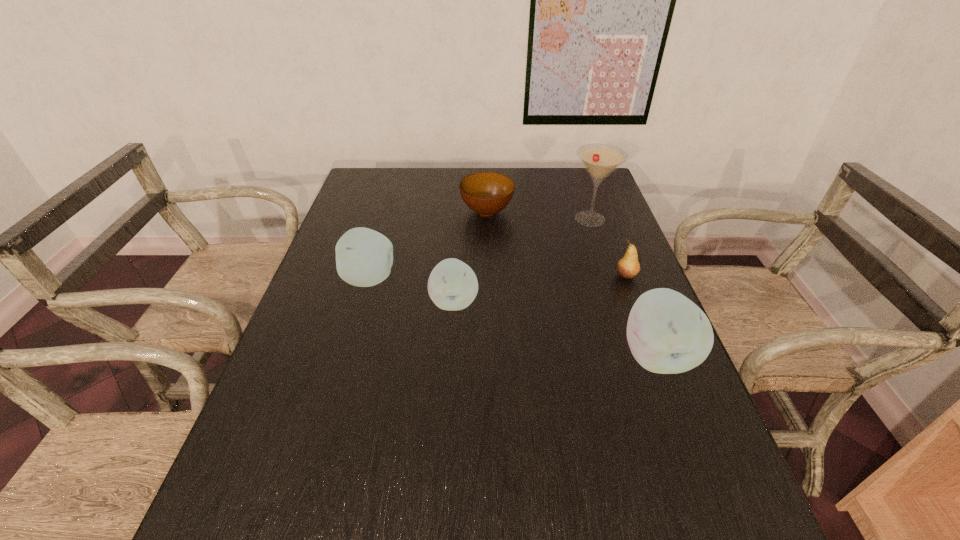
Locate an element on the screen. This screenshot has height=540, width=960. vacant space located 0.230m on the left of the nearest apple is located at coordinates (516, 355).

Where is `blank area located on the right of the bowl`? The image size is (960, 540). blank area located on the right of the bowl is located at coordinates (556, 212).

Where is `blank area located 0.130m on the left of the martini`? The width and height of the screenshot is (960, 540). blank area located 0.130m on the left of the martini is located at coordinates (527, 219).

The height and width of the screenshot is (540, 960). I want to click on blank space located on the back of the pear, so click(x=598, y=202).

The width and height of the screenshot is (960, 540). I want to click on object that is at the far edge, so click(486, 193).

At what (x,y) coordinates should I click in order to perform the action: click on object located in the left edge section of the desktop. Please return your answer as a coordinate pair (x, y). Image resolution: width=960 pixels, height=540 pixels. Looking at the image, I should click on (364, 257).

Image resolution: width=960 pixels, height=540 pixels. Find the location of `apple that is at the right edge`. apple that is at the right edge is located at coordinates (667, 333).

The image size is (960, 540). Find the location of `martini that is at the right edge`. martini that is at the right edge is located at coordinates (600, 160).

At what (x,y) coordinates should I click in order to perform the action: click on pear that is at the right edge. Please return your answer as a coordinate pair (x, y). Looking at the image, I should click on (627, 267).

In the image, there is a desktop. Identify the location of vacant space at the near edge. (452, 460).